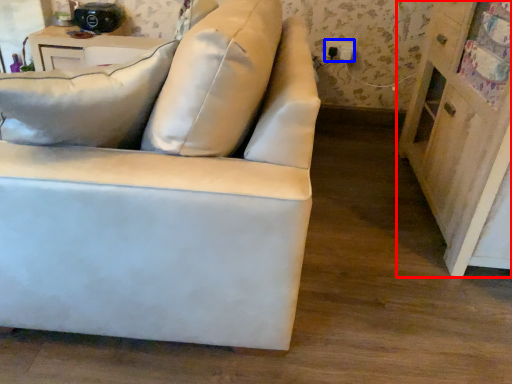
Question: Which object is further to the camera taking this photo, dresser (highlighted by a red box) or electric outlet (highlighted by a blue box)?

Choices:
 (A) dresser
 (B) electric outlet

Answer: (B)